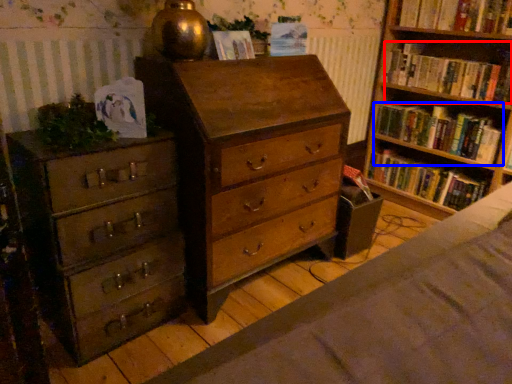
Question: Which point is further to the camera, book (highlighted by a red box) or book (highlighted by a blue box)?

Choices:
 (A) book
 (B) book

Answer: (B)